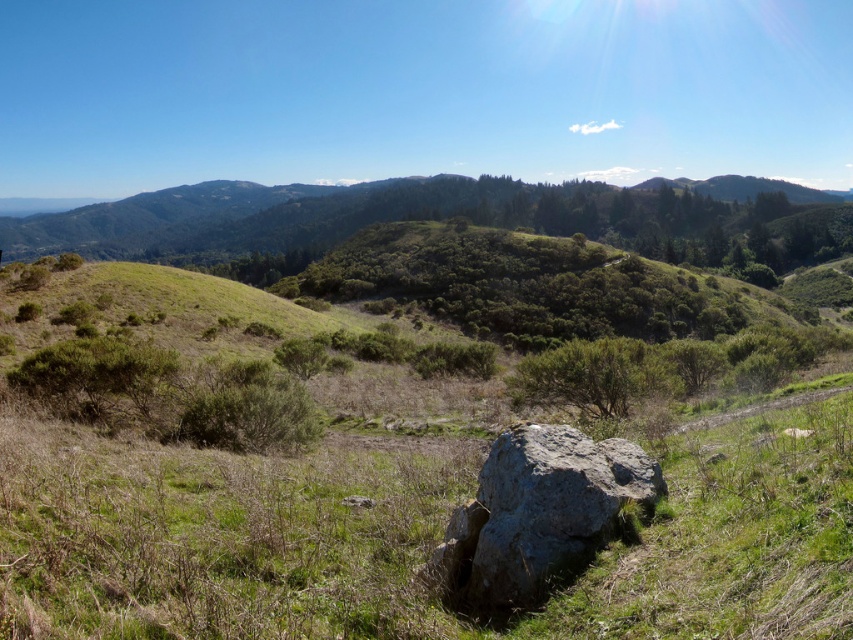
Between green grassy at center and gray rough rock at center, which one has less height?

Standing shorter between the two is gray rough rock at center.

Which is behind, point (35, 448) or point (498, 502)?

Point (35, 448)

Who is more distant from viewer, (172,513) or (480,536)?

The point (172,513) is behind.

Where is `green grassy at center`? This screenshot has width=853, height=640. green grassy at center is located at coordinates (225, 477).

What do you see at coordinates (392, 212) in the screenshot? This screenshot has height=640, width=853. I see `green grassy hill at upper center` at bounding box center [392, 212].

Does green grassy hill at upper center lie behind gray rough rock at center?

Yes, green grassy hill at upper center is behind gray rough rock at center.

Who is more forward, (241, 243) or (531, 477)?

Point (531, 477) is in front.

Locate an element on the screen. The width and height of the screenshot is (853, 640). green grassy hill at upper center is located at coordinates (392, 212).

The height and width of the screenshot is (640, 853). What are the coordinates of `green grassy at center` in the screenshot? It's located at (225, 477).

Can you confirm if green grassy at center is thinner than green grassy hill at upper center?

Yes.

Who is more forward, [103,588] or [91,246]?

Point [103,588] is in front.

I want to click on green grassy at center, so click(x=225, y=477).